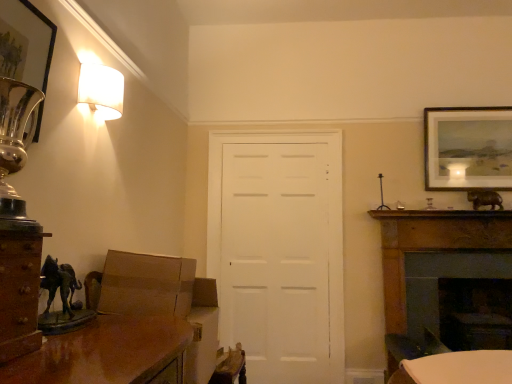
Identify the location of vacant space situated above matte gold picture frame at upper right, the first picture frame from the right (from a real-world perspective). (465, 110).